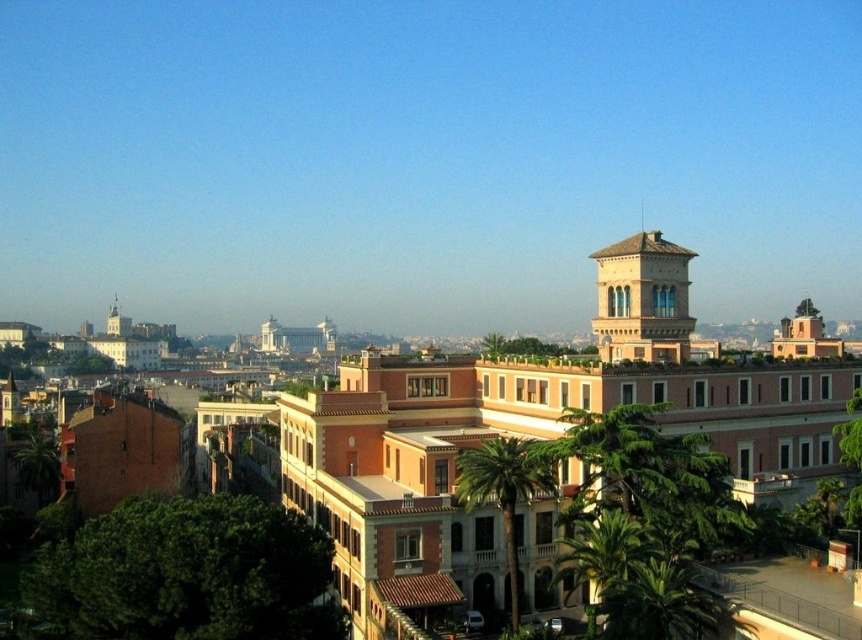
You are a city planner assessing the view of the cityscape. You need to determine which palm tree, the green leafy palm tree at center or the green leafy palm tree at lower right, would block the view of the large terracotta building more when viewed from the front. Which one would it be?

The green leafy palm tree at center is much taller than the green leafy palm tree at lower right, so it would block the view of the large terracotta building more when viewed from the front.